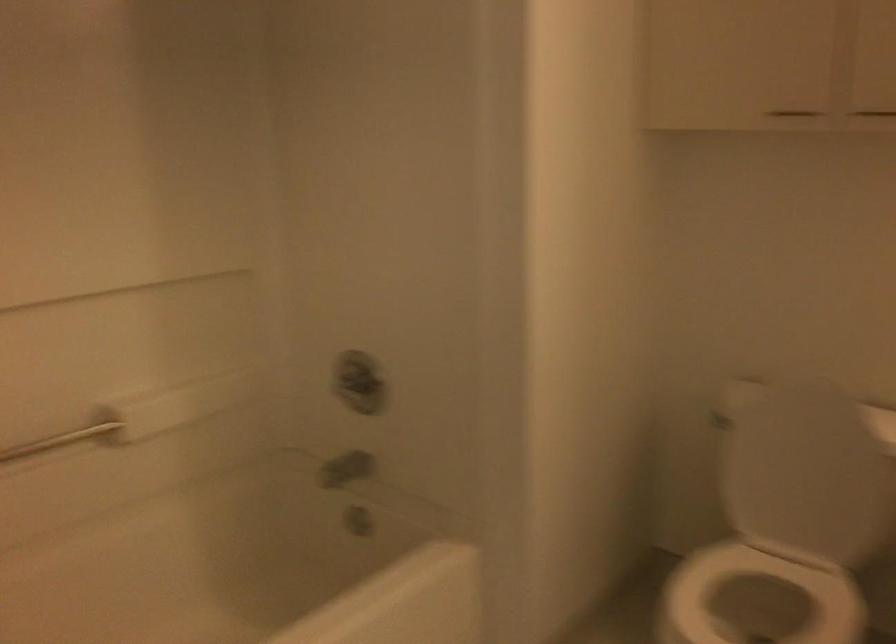
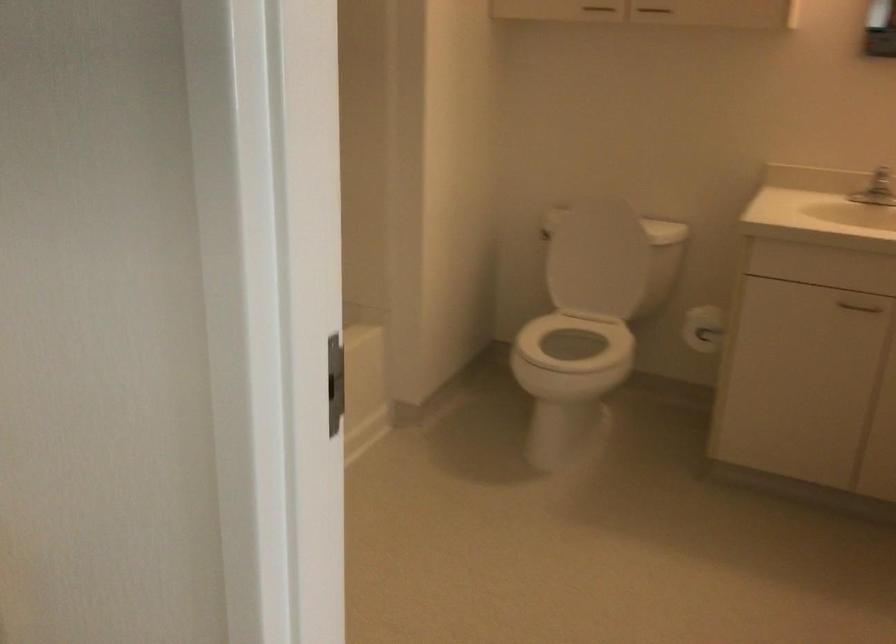
The point at (798,111) is marked in the first image. Where is the corresponding point in the second image?

(599, 8)